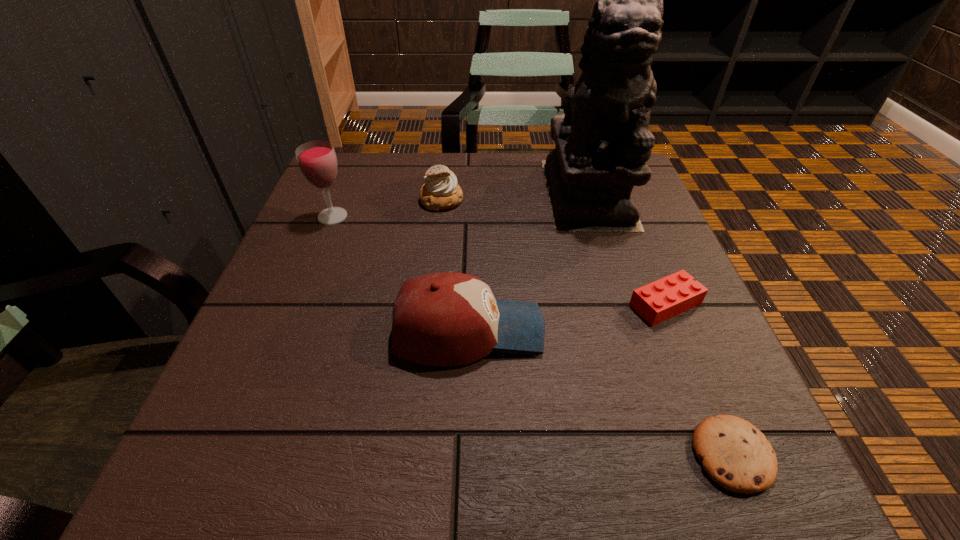
Find the location of `free space that satisfies the following two spatial constraints: 1. on the front-facing side of the tallest object; 2. on the right side of the nearest object`. free space that satisfies the following two spatial constraints: 1. on the front-facing side of the tallest object; 2. on the right side of the nearest object is located at coordinates (670, 455).

Where is `vacant area that satisfies the following two spatial constraints: 1. on the back side of the pastry; 2. on the left side of the second tallest object`? This screenshot has height=540, width=960. vacant area that satisfies the following two spatial constraints: 1. on the back side of the pastry; 2. on the left side of the second tallest object is located at coordinates (339, 200).

This screenshot has width=960, height=540. Identify the location of free spot that satisfies the following two spatial constraints: 1. on the front-facing side of the cookie; 2. on the left side of the tallest object. (670, 455).